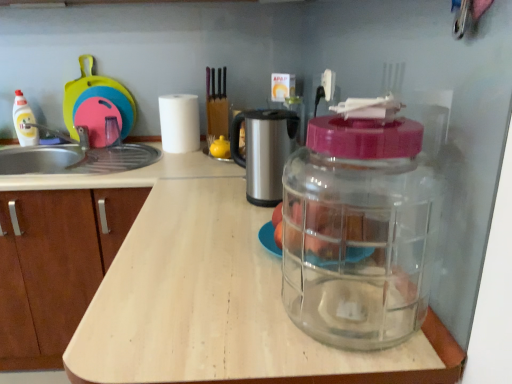
The width and height of the screenshot is (512, 384). I want to click on free space to the left of translucent glass apples at center, so click(216, 244).